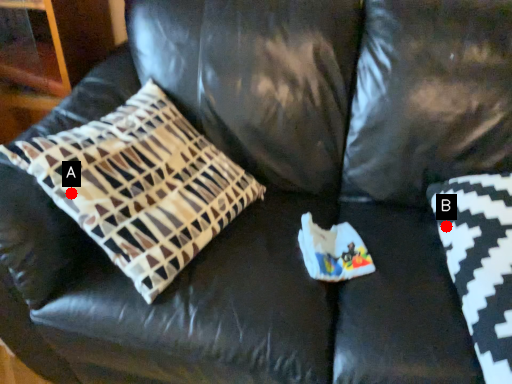
Question: Two points are circled on the image, labeled by A and B beside each circle. Among these points, which one is nearest to the camera?

Choices:
 (A) A is closer
 (B) B is closer

Answer: (A)